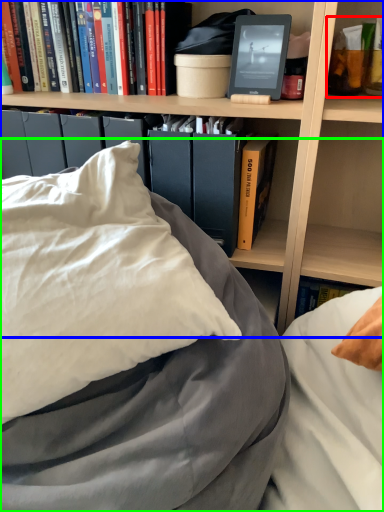
Question: Estimate the real-world distances between objects in this image. Which object is farther from book (highlighted by a red box), bookcase (highlighted by a blue box) or bed (highlighted by a green box)?

Choices:
 (A) bookcase
 (B) bed

Answer: (B)